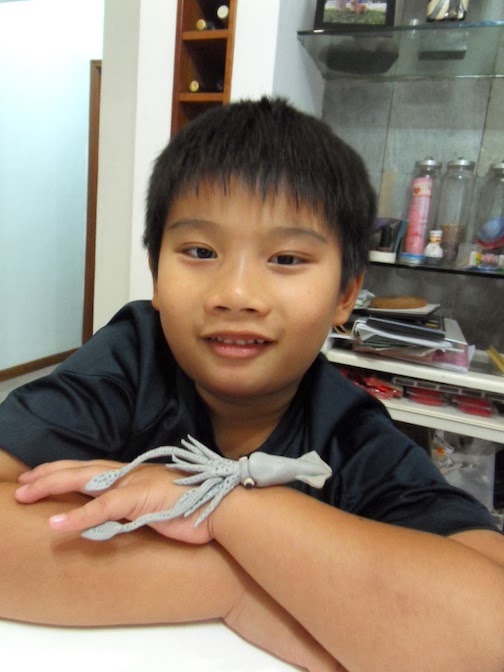
This screenshot has height=672, width=504. In order to click on octopus toy on left wrist of boy in center in this screenshot , I will do `click(296, 472)`, `click(225, 472)`, `click(192, 501)`, `click(119, 466)`.